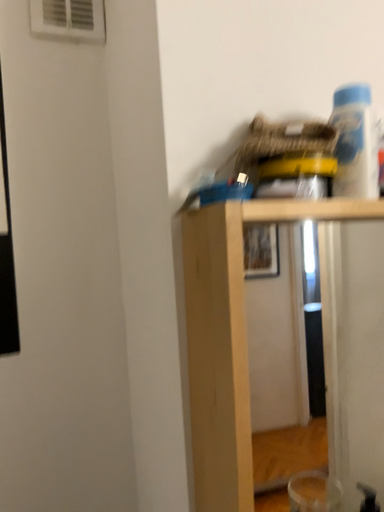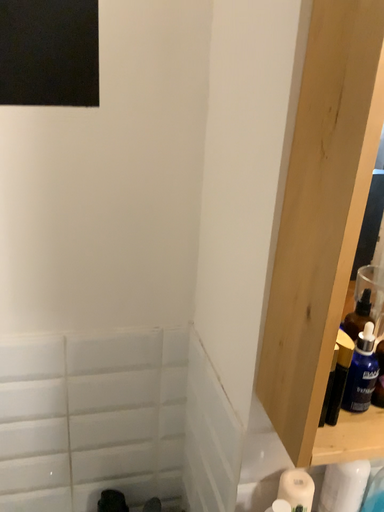
Question: Which way did the camera rotate in the video?

Choices:
 (A) rotated left
 (B) rotated right

Answer: (A)